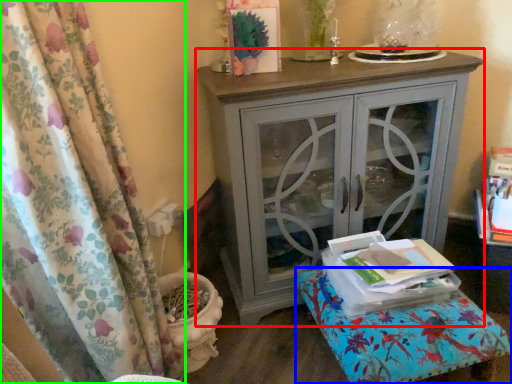
Question: Which is farther away from nightstand (highlighted by a red box)? furniture (highlighted by a blue box) or curtain (highlighted by a green box)?

Choices:
 (A) furniture
 (B) curtain

Answer: (B)